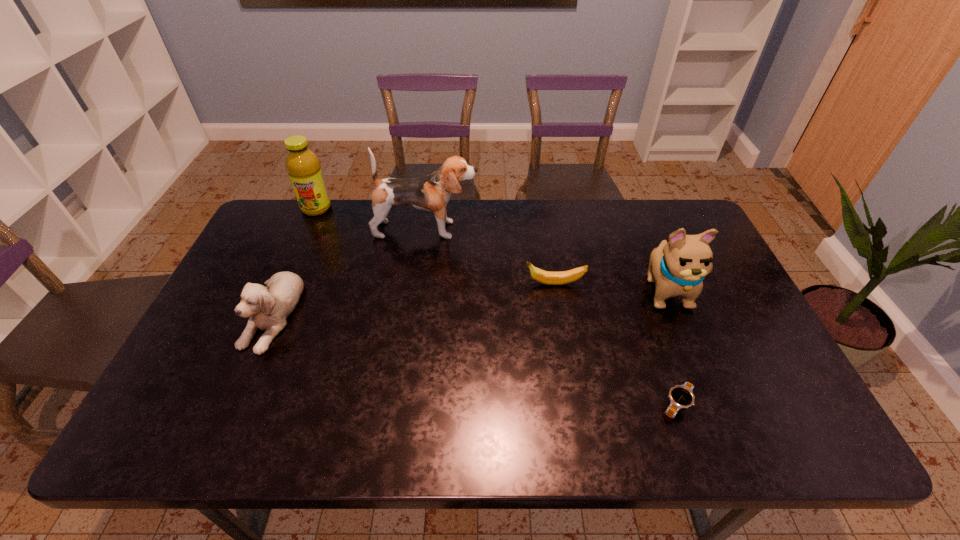
Locate an element on the screen. Image resolution: width=960 pixels, height=540 pixels. vacant area between the third shortest object and the second tallest puppy is located at coordinates (468, 301).

Locate an element on the screen. Image resolution: width=960 pixels, height=540 pixels. empty location between the nearest object and the fourth object from right to left is located at coordinates (551, 317).

Identify the location of empty space between the second shortest puppy and the fifth nearest object. (546, 259).

You are a GUI agent. You are given a task and a screenshot of the screen. Output one action in this format:
    pyautogui.click(x=<x>, y=<y>)
    Task: Click on the free space between the leftmost puppy and the fourth object from left to right
    
    Given the screenshot: What is the action you would take?
    pyautogui.click(x=413, y=299)

This screenshot has width=960, height=540. I want to click on empty space between the fruit juice and the fifth tallest object, so click(x=436, y=246).

Find the location of a particular element. The width and height of the screenshot is (960, 540). free space between the second shortest object and the shortest puppy is located at coordinates (413, 299).

Identify the location of vacant space that's between the fifth tallest object and the shortest puppy. The height and width of the screenshot is (540, 960). (413, 299).

This screenshot has height=540, width=960. In order to click on unoccupied position between the second tallest puppy and the leftmost puppy in this screenshot , I will do [x=468, y=301].

Find the location of a particular element. Image resolution: width=960 pixels, height=540 pixels. free spot between the nearest object and the second puppy from right to left is located at coordinates (551, 317).

I want to click on free space between the farthest object and the nearest object, so click(496, 307).